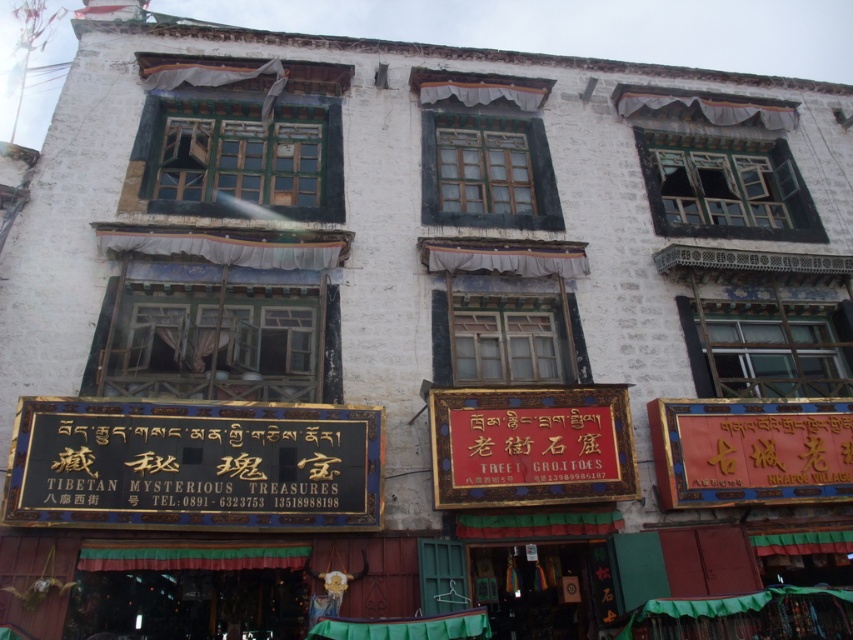
Question: Can you confirm if gold metallic signboard at center is wider than red glossy signboard at right?

Choices:
 (A) no
 (B) yes

Answer: (A)

Question: Does gold metallic signboard at center have a larger size compared to red glossy signboard at right?

Choices:
 (A) no
 (B) yes

Answer: (A)

Question: Which point is closer to the camera taking this photo?

Choices:
 (A) (733, 474)
 (B) (431, 420)

Answer: (B)

Question: Based on their relative distances, which object is nearer to the red glossy signboard at right?

Choices:
 (A) gold metallic signboard at center
 (B) gold-gilded wood signboard at lower left

Answer: (A)

Question: Estimate the real-world distances between objects in this image. Which object is closer to the gold metallic signboard at center?

Choices:
 (A) red glossy signboard at right
 (B) gold-gilded wood signboard at lower left

Answer: (A)

Question: Is gold metallic signboard at center positioned in front of red glossy signboard at right?

Choices:
 (A) no
 (B) yes

Answer: (B)